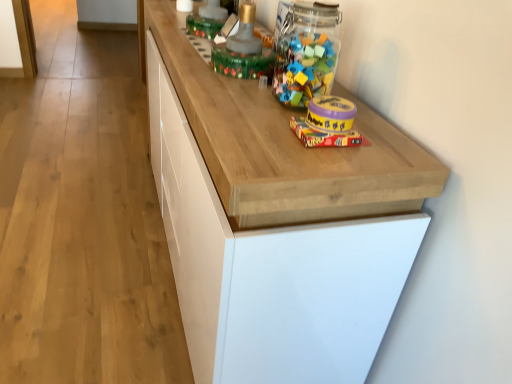
Locate an element on the screen. This screenshot has width=512, height=384. vacant area located to the right-hand side of matte yellow plastic container at center, which is the third toy from back to front is located at coordinates (398, 141).